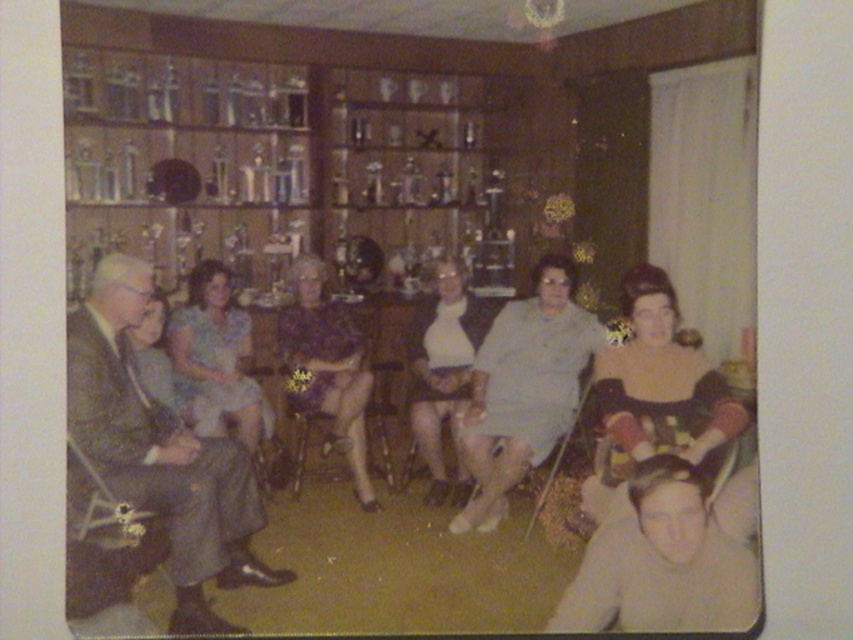
Is point (575, 609) positioned after point (345, 410)?

No, (575, 609) is closer to viewer.

Image resolution: width=853 pixels, height=640 pixels. I want to click on light brown leather jacket at lower right, so click(669, 557).

At what (x,y) coordinates should I click in order to perform the action: click on light brown leather jacket at lower right. Please return your answer as a coordinate pair (x, y). The height and width of the screenshot is (640, 853). Looking at the image, I should click on (669, 557).

Does light beige fabric dress at center appear under matte purple blouse at center?

Yes.

In the scene shown: Does light beige fabric dress at center have a greater height compared to matte purple blouse at center?

In fact, light beige fabric dress at center may be shorter than matte purple blouse at center.

Does point (503, 349) lie behind point (364, 406)?

Yes, it is behind point (364, 406).

Where is `light beige fabric dress at center`? This screenshot has height=640, width=853. light beige fabric dress at center is located at coordinates (524, 388).

Between light beige fabric dress at center and light blue fabric dress at center, which one appears on the right side from the viewer's perspective?

light beige fabric dress at center is more to the right.

Is light beige fabric dress at center to the right of light blue fabric dress at center from the viewer's perspective?

Indeed, light beige fabric dress at center is positioned on the right side of light blue fabric dress at center.

Describe the element at coordinates (524, 388) in the screenshot. This screenshot has height=640, width=853. I see `light beige fabric dress at center` at that location.

What are the coordinates of `light beige fabric dress at center` in the screenshot? It's located at (524, 388).